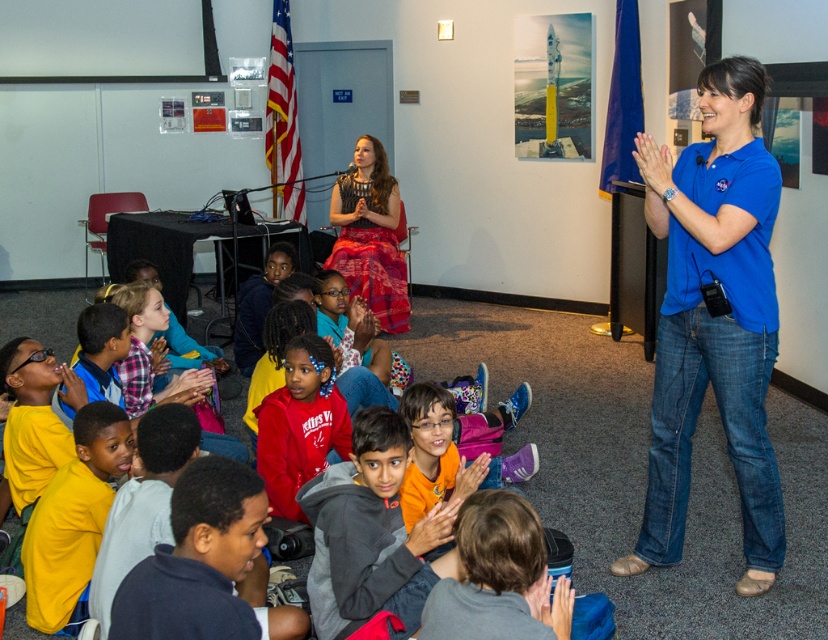
Who is higher up, gray fleece jacket at center or red fleece sweatshirt at center?

Positioned higher is red fleece sweatshirt at center.

Is gray fleece jacket at center wider than red fleece sweatshirt at center?

Yes, gray fleece jacket at center is wider than red fleece sweatshirt at center.

Where is `gray fleece jacket at center`? This screenshot has width=828, height=640. gray fleece jacket at center is located at coordinates (369, 532).

Is blue cotton shirt at right bigger than dark blue shirt at lower left?

Answer: Indeed, blue cotton shirt at right has a larger size compared to dark blue shirt at lower left.

Is blue cotton shirt at right taller than dark blue shirt at lower left?

Correct, blue cotton shirt at right is much taller as dark blue shirt at lower left.

Find the location of a particular element. blue cotton shirt at right is located at coordinates (715, 317).

Is the position of red fleece sweatshirt at center less distant than that of matte red skirt at center?

Yes, it is.

Does red fleece sweatshirt at center appear on the right side of matte red skirt at center?

Yes, red fleece sweatshirt at center is to the right of matte red skirt at center.

Between point (321, 396) and point (360, 144), which one is positioned in front?

Point (321, 396)

Identify the location of red fleece sweatshirt at center. (299, 426).